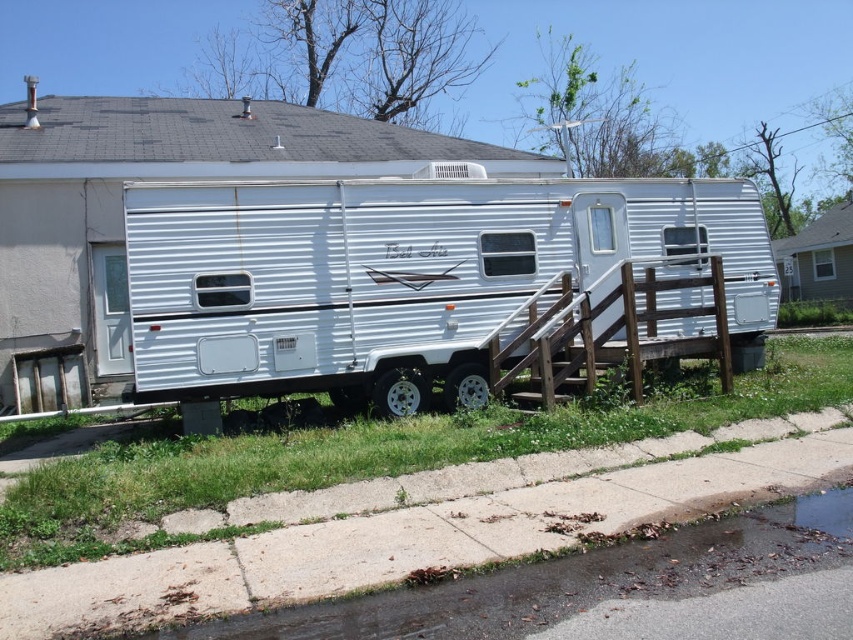
Question: Does white metallic trailer at center have a greater width compared to wooden rail at center?

Choices:
 (A) no
 (B) yes

Answer: (B)

Question: Among these objects, which one is farthest from the camera?

Choices:
 (A) wooden rail at center
 (B) white metallic trailer at center

Answer: (A)

Question: Can you confirm if white metallic trailer at center is wider than wooden rail at center?

Choices:
 (A) yes
 (B) no

Answer: (A)

Question: Which point appears closest to the camera in this image?

Choices:
 (A) (679, 307)
 (B) (567, 268)

Answer: (B)

Question: Which point is farther from the camera taking this photo?

Choices:
 (A) (326, 227)
 (B) (572, 307)

Answer: (A)

Question: Is white metallic trailer at center to the right of wooden rail at center from the viewer's perspective?

Choices:
 (A) yes
 (B) no

Answer: (B)